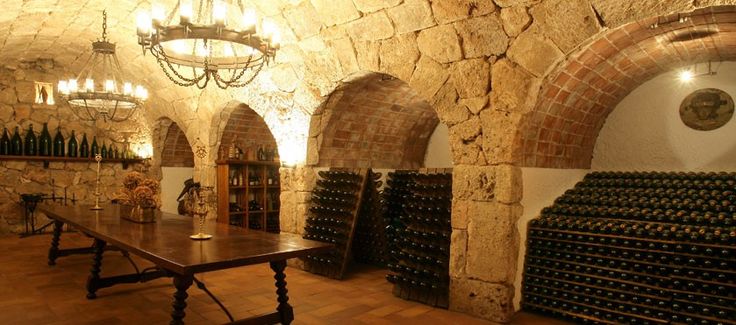
Where is `table top`? table top is located at coordinates (149, 236).